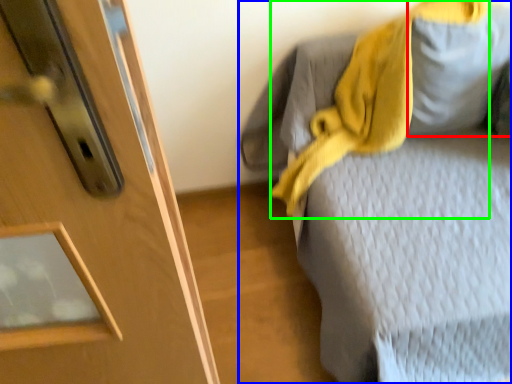
Question: Which is nearer to the gray (highlighted by a red box)? furniture (highlighted by a blue box) or scarf (highlighted by a green box).

Choices:
 (A) furniture
 (B) scarf

Answer: (B)